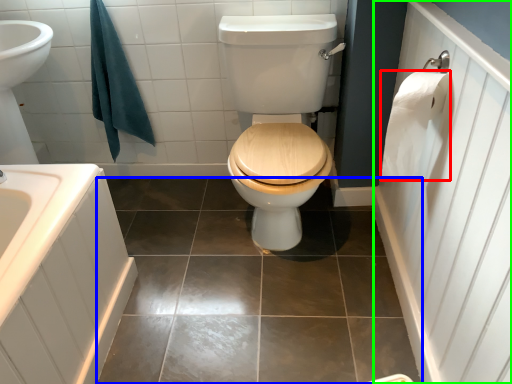
Question: Which object is the closest to the toilet paper (highlighted by a red box)? Choose among these: ceramic tile (highlighted by a blue box) or side (highlighted by a green box).

Choices:
 (A) ceramic tile
 (B) side

Answer: (B)